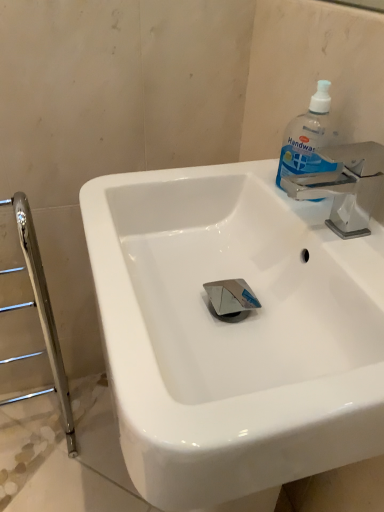
Question: From the image's perspective, is transparent plastic handwash at upper right positioned above or below white glossy sink at center?

Choices:
 (A) below
 (B) above

Answer: (B)

Question: Considering their positions, is transparent plastic handwash at upper right located in front of or behind white glossy sink at center?

Choices:
 (A) front
 (B) behind

Answer: (B)

Question: Is transparent plastic handwash at upper right taller or shorter than white glossy sink at center?

Choices:
 (A) short
 (B) tall

Answer: (A)

Question: From the image's perspective, relative to transparent plastic handwash at upper right, is white glossy sink at center above or below?

Choices:
 (A) below
 (B) above

Answer: (A)

Question: In terms of height, does white glossy sink at center look taller or shorter compared to transparent plastic handwash at upper right?

Choices:
 (A) tall
 (B) short

Answer: (A)

Question: Is white glossy sink at center inside or outside of transparent plastic handwash at upper right?

Choices:
 (A) inside
 (B) outside

Answer: (B)

Question: Visually, is white glossy sink at center positioned to the left or to the right of transparent plastic handwash at upper right?

Choices:
 (A) left
 (B) right

Answer: (A)